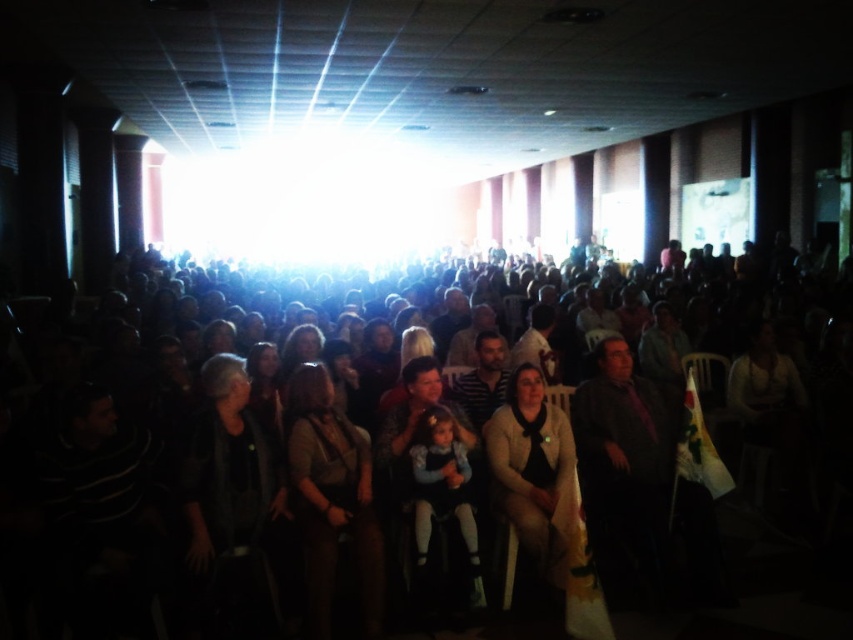
Question: Is light beige sweater at center bigger than dark gray fabric jacket at center?

Choices:
 (A) yes
 (B) no

Answer: (B)

Question: Is dark clothing crowd at center thinner than dark gray fabric jacket at center?

Choices:
 (A) yes
 (B) no

Answer: (B)

Question: Considering the real-world distances, which object is closest to the dark gray fabric jacket at center?

Choices:
 (A) dark clothing crowd at center
 (B) light beige sweater at center

Answer: (B)

Question: Does dark fabric jacket at center appear over dark gray fabric jacket at center?

Choices:
 (A) yes
 (B) no

Answer: (A)

Question: Which point appears farthest from the camera in this image?

Choices:
 (A) (318, 497)
 (B) (518, 525)
 (C) (209, 428)

Answer: (B)

Question: Estimate the real-world distances between objects in this image. Which object is farther from the dark clothing crowd at center?

Choices:
 (A) light beige sweater at center
 (B) dark gray fabric jacket at center
 (C) dark fabric jacket at center

Answer: (A)